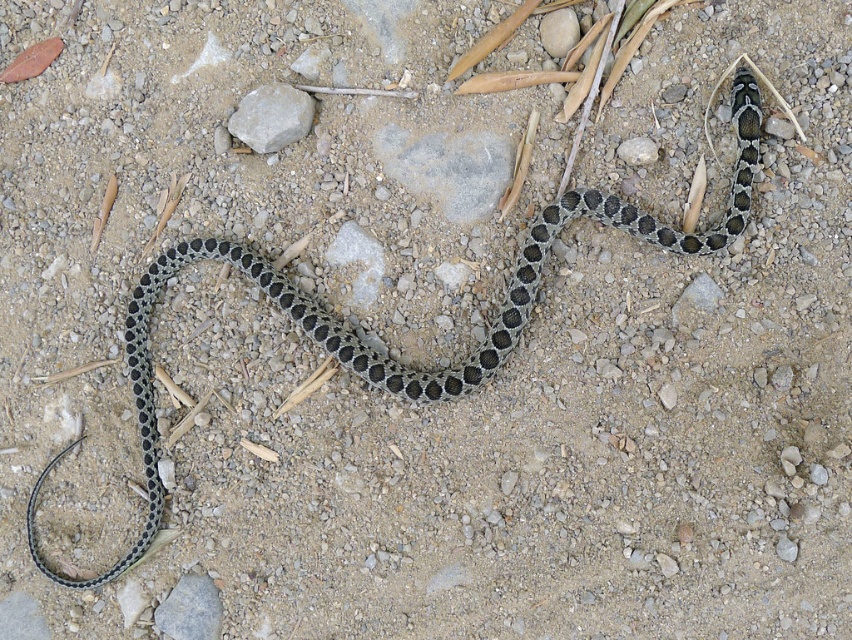
Between gray rock at upper center and gray smooth rock at center, which one is positioned lower?

gray smooth rock at center is lower down.

Describe the element at coordinates (271, 116) in the screenshot. Image resolution: width=852 pixels, height=640 pixels. I see `gray rock at upper center` at that location.

Locate an element on the screen. This screenshot has height=640, width=852. gray rock at upper center is located at coordinates (271, 116).

Is the position of black dotted snake at center less distant than that of gray rock at center?

Yes, black dotted snake at center is in front of gray rock at center.

Can you confirm if black dotted snake at center is bigger than gray rock at center?

Yes, black dotted snake at center is bigger than gray rock at center.

Is point (717, 237) more distant than point (432, 198)?

No, it is not.

Where is `black dotted snake at center`? The height and width of the screenshot is (640, 852). black dotted snake at center is located at coordinates (376, 349).

Can you confirm if gray rock at center is positioned to the left of gray rock at upper center?

In fact, gray rock at center is to the right of gray rock at upper center.

Which is above, gray rock at center or gray rock at upper center?

gray rock at upper center

Between point (456, 148) and point (248, 138), which one is positioned in front?

Positioned in front is point (456, 148).

This screenshot has width=852, height=640. What are the coordinates of `gray rock at center` in the screenshot? It's located at (448, 168).